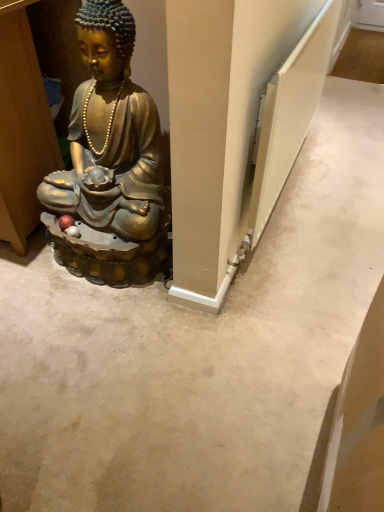
Question: Considering the positions of point (268, 202) and point (114, 67), is point (268, 202) closer or farther from the camera than point (114, 67)?

Choices:
 (A) closer
 (B) farther

Answer: (B)

Question: From a real-world perspective, is white textured radiator at right above or below gold metallic statue at left?

Choices:
 (A) above
 (B) below

Answer: (A)

Question: In terms of height, does white textured radiator at right look taller or shorter compared to gold metallic statue at left?

Choices:
 (A) tall
 (B) short

Answer: (B)

Question: Does point (122, 117) appear closer or farther from the camera than point (279, 117)?

Choices:
 (A) farther
 (B) closer

Answer: (A)

Question: Considering the relative positions of gold metallic statue at left and white textured radiator at right in the image provided, is gold metallic statue at left to the left or to the right of white textured radiator at right?

Choices:
 (A) left
 (B) right

Answer: (A)

Question: Relative to white textured radiator at right, is gold metallic statue at left in front or behind?

Choices:
 (A) behind
 (B) front

Answer: (B)

Question: Looking at their shapes, would you say gold metallic statue at left is wider or thinner than white textured radiator at right?

Choices:
 (A) wide
 (B) thin

Answer: (A)